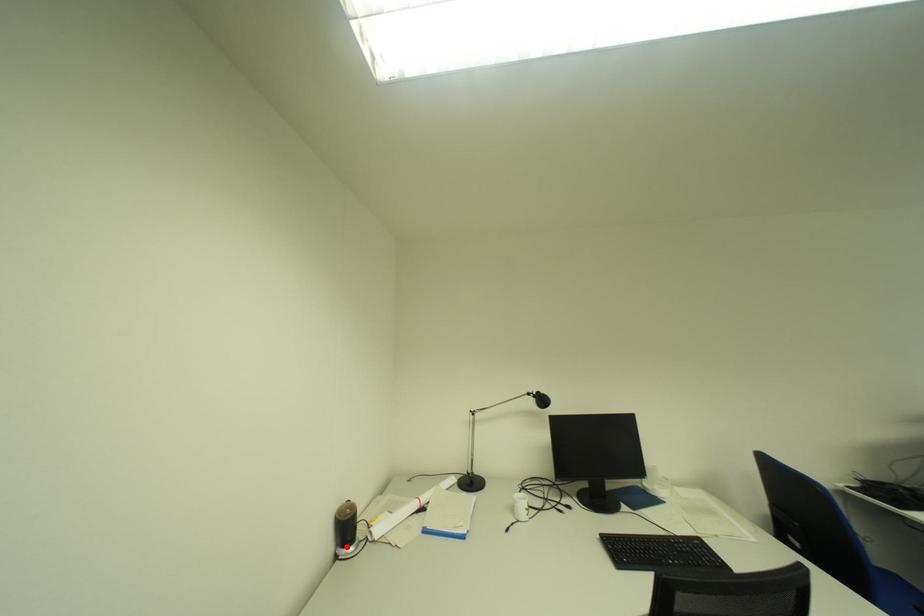
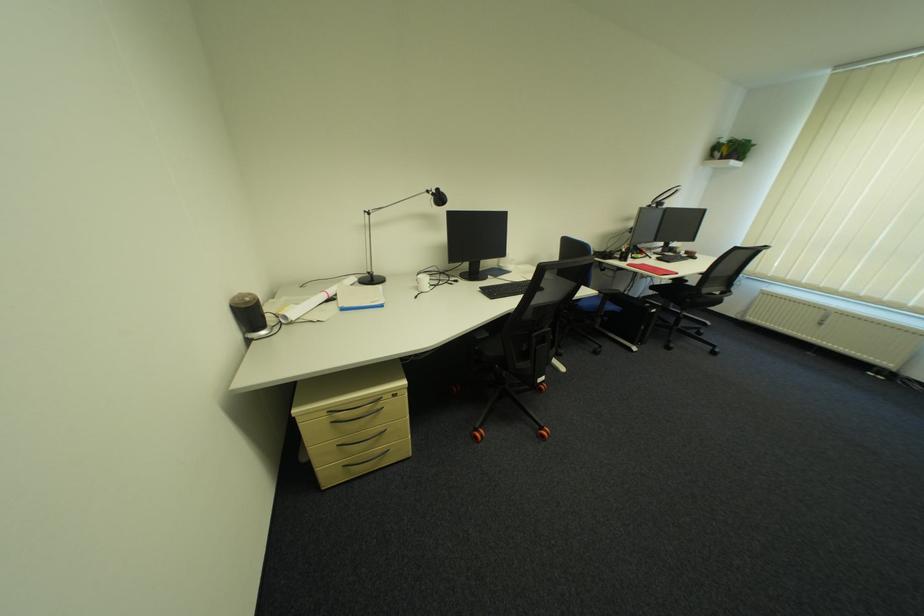
Where in the second image is the point corresponding to the highlighted location from the first image?

(253, 334)